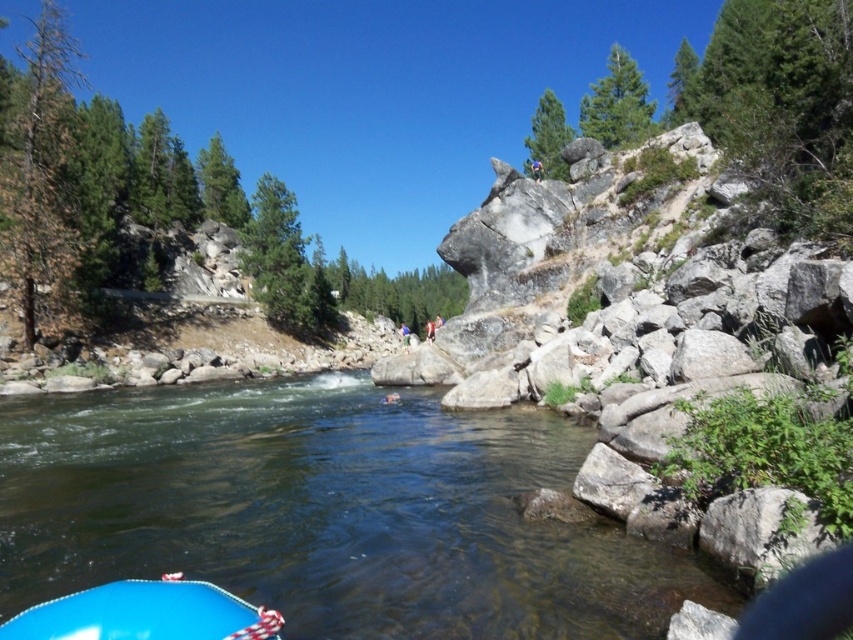
Question: Is blue rubber boat at lower left to the left of blue fabric person at center from the viewer's perspective?

Choices:
 (A) yes
 (B) no

Answer: (B)

Question: Is clear water at lower center thinner than blue rubber boat at lower left?

Choices:
 (A) no
 (B) yes

Answer: (A)

Question: Among these objects, which one is nearest to the camera?

Choices:
 (A) blue rubber boat at lower left
 (B) blue fabric person at center
 (C) clear water at lower center

Answer: (A)

Question: Among these points, which one is farthest from the camera?

Choices:
 (A) (408, 332)
 (B) (22, 420)
 (C) (33, 609)

Answer: (A)

Question: Which point is farther from the camera taking this photo?

Choices:
 (A) (402, 333)
 (B) (82, 442)

Answer: (A)

Question: Observing the image, what is the correct spatial positioning of clear water at lower center in reference to blue rubber boat at lower left?

Choices:
 (A) below
 (B) above

Answer: (A)